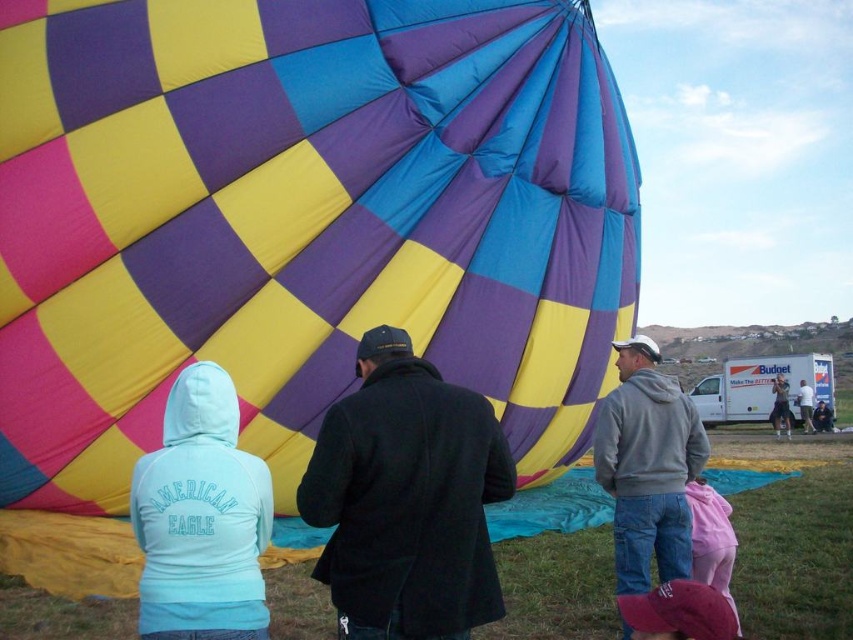
Who is lower down, checkered fabric balloon at center or light blue hoodie at lower left?

light blue hoodie at lower left is lower down.

Is checkered fabric balloon at center positioned before light blue hoodie at lower left?

No, checkered fabric balloon at center is behind light blue hoodie at lower left.

Identify the location of checkered fabric balloon at center. This screenshot has width=853, height=640. (300, 220).

Between checkered fabric hot air balloon at center and pink fabric cap at lower center, which one is positioned higher?

pink fabric cap at lower center is above.

Is checkered fabric hot air balloon at center wider than pink fabric cap at lower center?

Yes.

The height and width of the screenshot is (640, 853). Describe the element at coordinates (793, 538) in the screenshot. I see `checkered fabric hot air balloon at center` at that location.

Find the location of `checkered fabric hot air balloon at center`. checkered fabric hot air balloon at center is located at coordinates (793, 538).

Can you confirm if denim jacket at lower right is positioned to the left of light blue hoodie at center?

Indeed, denim jacket at lower right is positioned on the left side of light blue hoodie at center.

Which is more to the right, denim jacket at lower right or light blue hoodie at center?

light blue hoodie at center is more to the right.

At what (x,y) coordinates should I click in order to perform the action: click on denim jacket at lower right. Please return your answer as a coordinate pair (x, y). Looking at the image, I should click on (780, 406).